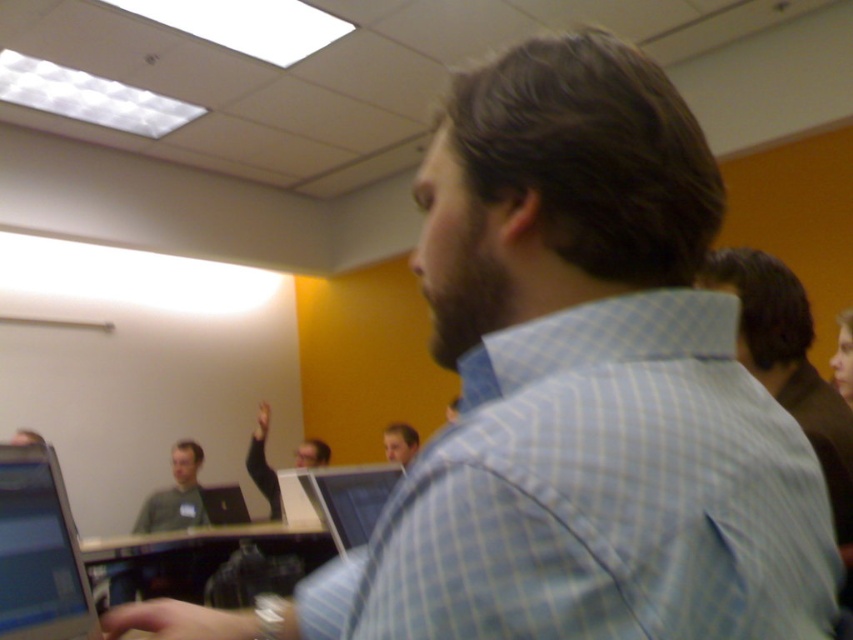
Question: Which object is the farthest from the matte black hand at upper center?

Choices:
 (A) shiny black laptop at left
 (B) matte black laptop at center
 (C) smooth skin hand at lower left
 (D) gray sweater at lower left

Answer: (C)

Question: Which point is closer to the camera?

Choices:
 (A) (264, 442)
 (B) (3, 532)

Answer: (B)

Question: From the image, what is the correct spatial relationship of black glossy laptop at center in relation to smooth skin face at center?

Choices:
 (A) below
 (B) above

Answer: (A)

Question: Among these objects, which one is nearest to the camera?

Choices:
 (A) black glossy laptop at center
 (B) matte black hand at upper center

Answer: (A)

Question: Does matte black laptop at center appear on the right side of black fabric sleeve at upper center?

Choices:
 (A) yes
 (B) no

Answer: (A)

Question: Does shiny black laptop at left appear over matte black hand at upper center?

Choices:
 (A) yes
 (B) no

Answer: (A)